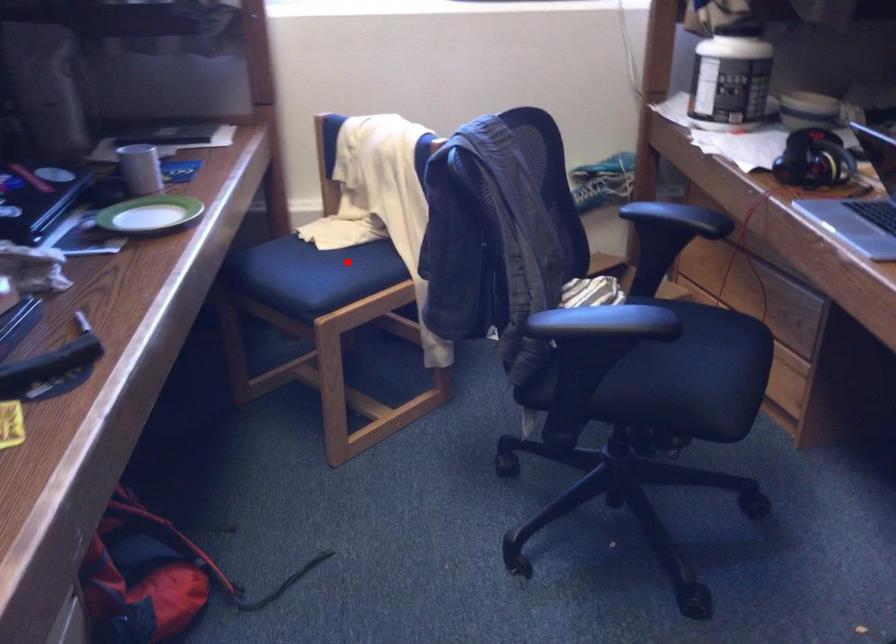
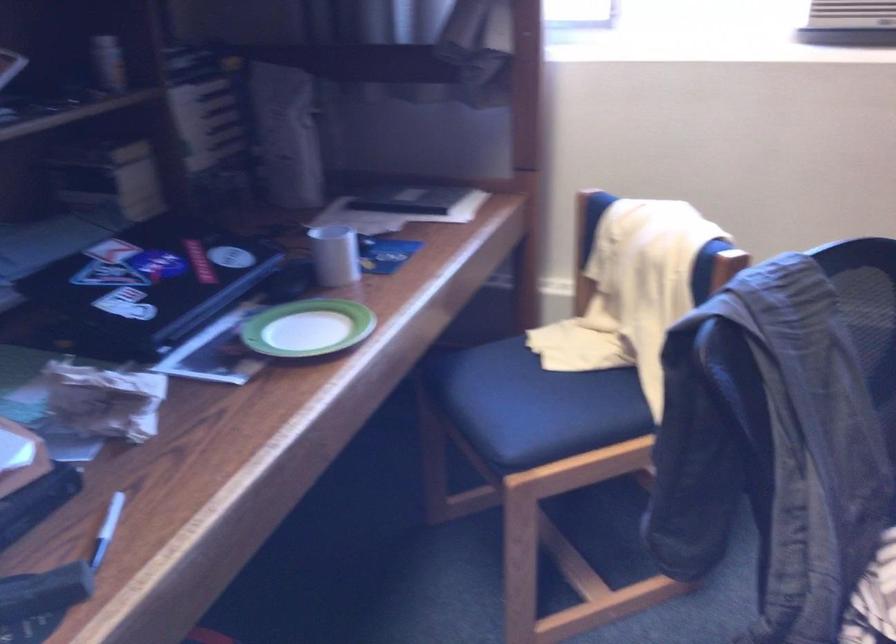
Question: I am providing you with two images of the same scene from different viewpoints. Image1 has a red point marked. In image2, the corresponding 3D location appears at what relative position? Reply with the corresponding letter.

Choices:
 (A) Closer
 (B) Farther

Answer: (A)